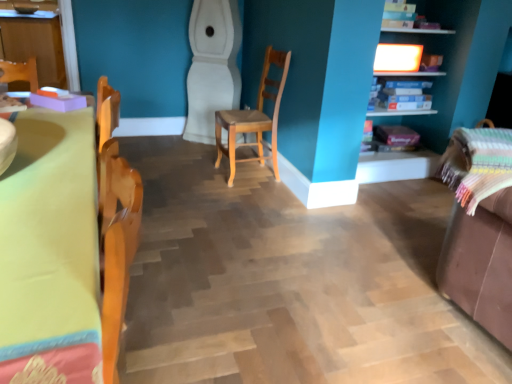
Question: From a real-world perspective, is wooden chair at center on blue cardboard boxes at upper right, which appears as the 2th shelf when viewed from the top?

Choices:
 (A) no
 (B) yes

Answer: (A)

Question: Is wooden chair at center at the right side of blue cardboard boxes at upper right, which appears as the 1th shelf when ordered from the bottom?

Choices:
 (A) yes
 (B) no

Answer: (B)

Question: Is wooden chair at center positioned far away from blue cardboard boxes at upper right, which appears as the 2th shelf when viewed from the top?

Choices:
 (A) yes
 (B) no

Answer: (A)

Question: Can you confirm if wooden chair at center is smaller than blue cardboard boxes at upper right, which appears as the 1th shelf when ordered from the bottom?

Choices:
 (A) yes
 (B) no

Answer: (B)

Question: Is wooden chair at center taller than blue cardboard boxes at upper right, which appears as the 1th shelf when ordered from the bottom?

Choices:
 (A) no
 (B) yes

Answer: (B)

Question: In terms of width, does blue cardboard boxes at upper right, which appears as the 2th shelf when viewed from the top, look wider or thinner when compared to matte wooden shelf at upper right, which is the first shelf from top to bottom?

Choices:
 (A) wide
 (B) thin

Answer: (B)

Question: Considering their positions, is blue cardboard boxes at upper right, which appears as the 2th shelf when viewed from the top, located in front of or behind matte wooden shelf at upper right, which is counted as the 2th shelf, starting from the bottom?

Choices:
 (A) front
 (B) behind

Answer: (B)

Question: Considering the positions of blue cardboard boxes at upper right, which appears as the 1th shelf when ordered from the bottom, and matte wooden shelf at upper right, which is the first shelf from top to bottom, in the image, is blue cardboard boxes at upper right, which appears as the 1th shelf when ordered from the bottom, bigger or smaller than matte wooden shelf at upper right, which is the first shelf from top to bottom,?

Choices:
 (A) big
 (B) small

Answer: (B)

Question: Would you say blue cardboard boxes at upper right, which appears as the 2th shelf when viewed from the top, is inside or outside matte wooden shelf at upper right, which is the first shelf from top to bottom?

Choices:
 (A) outside
 (B) inside

Answer: (B)

Question: In the image, is brown leather swivel chair at right positioned in front of or behind blue cardboard boxes at upper right, which appears as the 1th shelf when ordered from the bottom?

Choices:
 (A) front
 (B) behind

Answer: (A)

Question: Visually, is brown leather swivel chair at right positioned to the left or to the right of blue cardboard boxes at upper right, which appears as the 1th shelf when ordered from the bottom?

Choices:
 (A) right
 (B) left

Answer: (A)

Question: Looking at their shapes, would you say brown leather swivel chair at right is wider or thinner than blue cardboard boxes at upper right, which appears as the 2th shelf when viewed from the top?

Choices:
 (A) wide
 (B) thin

Answer: (A)

Question: From their relative heights in the image, would you say brown leather swivel chair at right is taller or shorter than blue cardboard boxes at upper right, which appears as the 1th shelf when ordered from the bottom?

Choices:
 (A) short
 (B) tall

Answer: (B)

Question: Would you say matte wooden shelf at upper right, which is the first shelf from top to bottom, is inside or outside wooden chair at center?

Choices:
 (A) outside
 (B) inside

Answer: (A)

Question: From a real-world perspective, relative to wooden chair at center, is matte wooden shelf at upper right, which is counted as the 2th shelf, starting from the bottom, vertically above or below?

Choices:
 (A) below
 (B) above

Answer: (B)